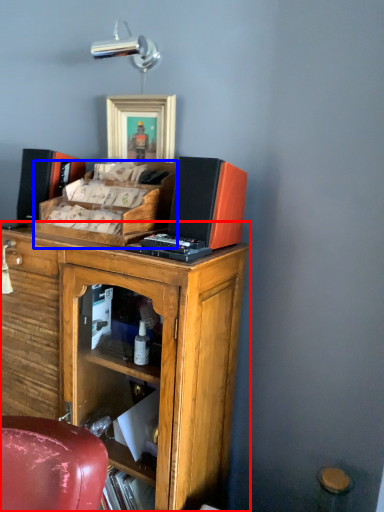
Question: Which object is further to the camera taking this photo, cabinetry (highlighted by a red box) or desk (highlighted by a blue box)?

Choices:
 (A) cabinetry
 (B) desk

Answer: (B)